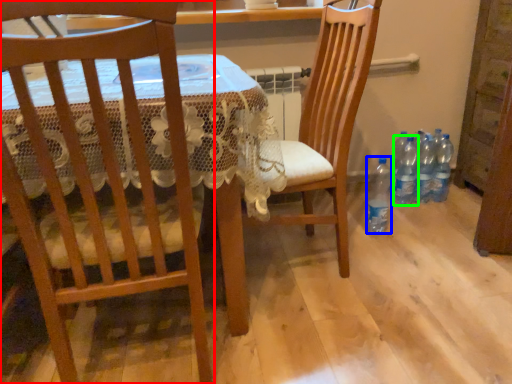
Question: Estimate the real-world distances between objects in this image. Which object is farther from chair (highlighted by a red box), bottle (highlighted by a blue box) or bottle (highlighted by a green box)?

Choices:
 (A) bottle
 (B) bottle

Answer: (B)